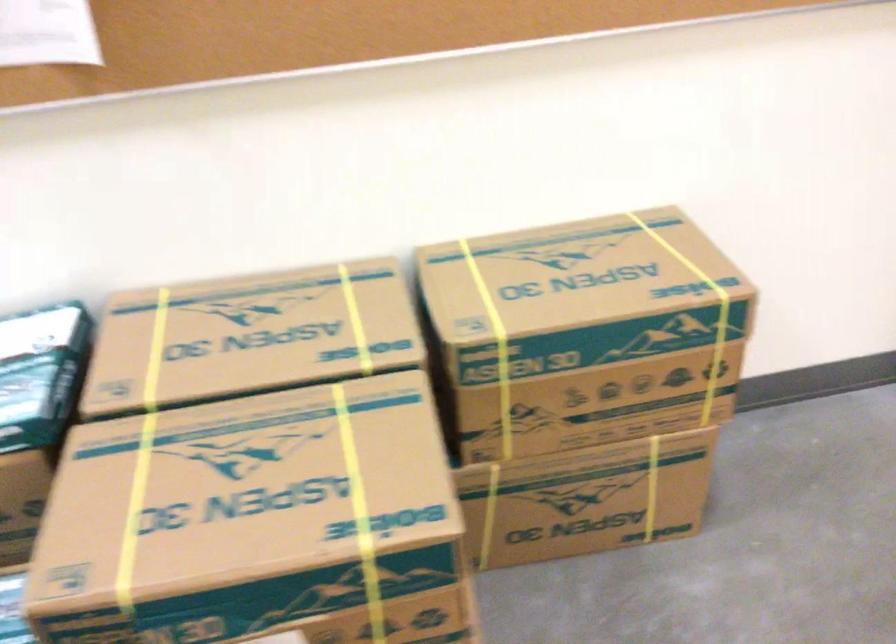
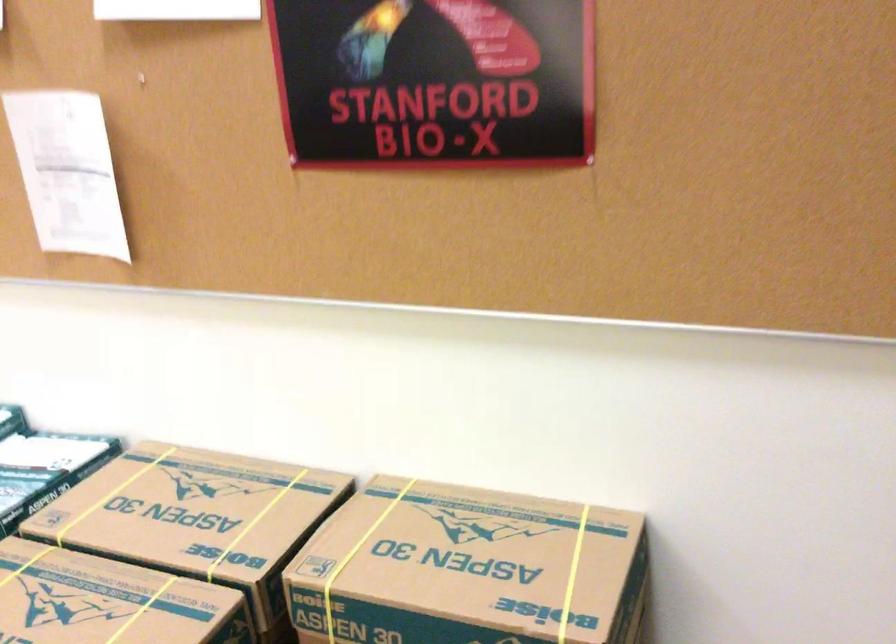
Where in the second image is the point corresponding to point 297,336 from the first image?

(197, 518)